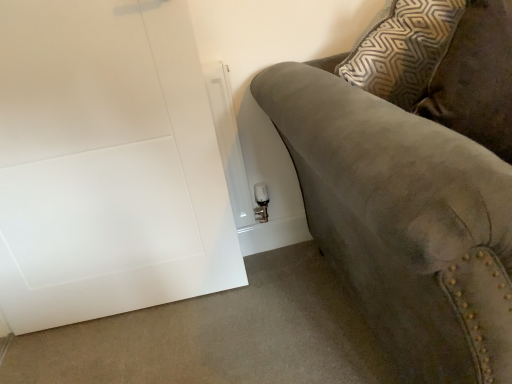
Question: Can you confirm if suede couch at right is taller than white matte door at lower left?

Choices:
 (A) yes
 (B) no

Answer: (B)

Question: Considering the relative sizes of suede couch at right and white matte door at lower left in the image provided, is suede couch at right wider than white matte door at lower left?

Choices:
 (A) no
 (B) yes

Answer: (B)

Question: From a real-world perspective, does suede couch at right sit lower than white matte door at lower left?

Choices:
 (A) no
 (B) yes

Answer: (B)

Question: Is suede couch at right behind white matte door at lower left?

Choices:
 (A) yes
 (B) no

Answer: (B)

Question: Is suede couch at right to the left of white matte door at lower left from the viewer's perspective?

Choices:
 (A) no
 (B) yes

Answer: (A)

Question: Can you confirm if suede couch at right is thinner than white matte door at lower left?

Choices:
 (A) no
 (B) yes

Answer: (A)

Question: Is white matte door at lower left at the left side of suede couch at right?

Choices:
 (A) yes
 (B) no

Answer: (A)

Question: Considering the relative sizes of white matte door at lower left and suede couch at right in the image provided, is white matte door at lower left bigger than suede couch at right?

Choices:
 (A) yes
 (B) no

Answer: (B)

Question: Is white matte door at lower left positioned before suede couch at right?

Choices:
 (A) yes
 (B) no

Answer: (B)

Question: From a real-world perspective, does white matte door at lower left sit lower than suede couch at right?

Choices:
 (A) no
 (B) yes

Answer: (A)

Question: Would you say suede couch at right is part of white matte door at lower left's contents?

Choices:
 (A) no
 (B) yes

Answer: (A)

Question: Can you confirm if white matte door at lower left is wider than suede couch at right?

Choices:
 (A) yes
 (B) no

Answer: (B)

Question: Looking at their shapes, would you say white matte door at lower left is wider or thinner than suede couch at right?

Choices:
 (A) thin
 (B) wide

Answer: (A)